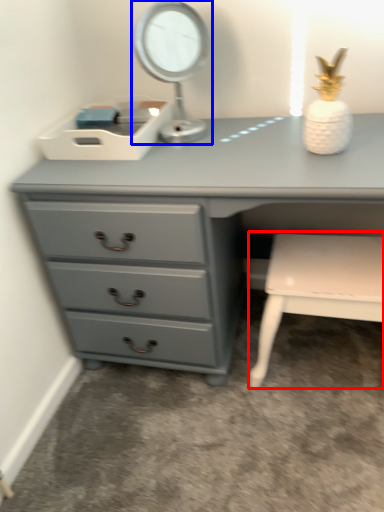
Question: Which object appears closest to the camera in this image, chair (highlighted by a red box) or table lamp (highlighted by a blue box)?

Choices:
 (A) chair
 (B) table lamp

Answer: (B)